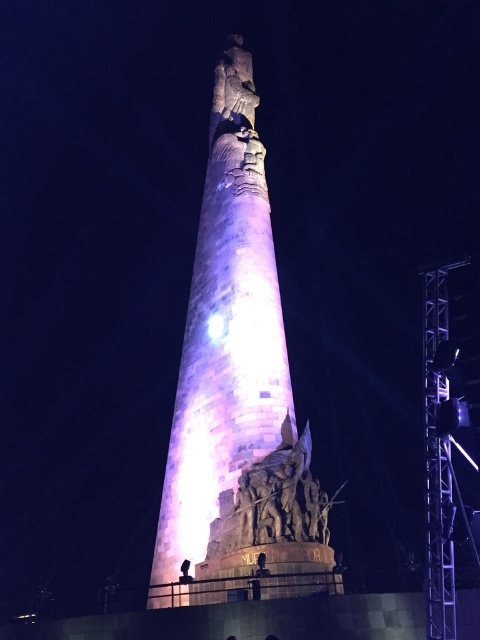
Question: Which of these objects is positioned farthest from the stone sculpture at lower center?

Choices:
 (A) purple stone tower at center
 (B) metallic scaffolding at right

Answer: (B)

Question: Among these points, which one is farthest from the camera?

Choices:
 (A) click(x=282, y=492)
 (B) click(x=428, y=637)

Answer: (A)

Question: Where is stone sculpture at lower center located in relation to metallic scaffolding at right in the image?

Choices:
 (A) below
 (B) above

Answer: (A)

Question: Does purple stone tower at center appear under metallic scaffolding at right?

Choices:
 (A) no
 (B) yes

Answer: (A)

Question: Which object is farther from the camera taking this photo?

Choices:
 (A) purple stone tower at center
 (B) stone sculpture at lower center

Answer: (A)

Question: Is purple stone tower at center above stone sculpture at lower center?

Choices:
 (A) yes
 (B) no

Answer: (A)